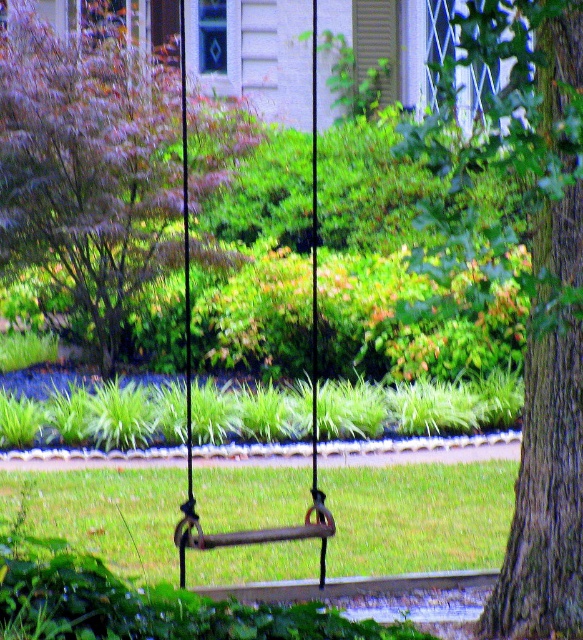
Question: Is the position of brown textured bark at right less distant than that of purple leafy tree at upper left?

Choices:
 (A) no
 (B) yes

Answer: (B)

Question: Among these points, which one is nearest to the camera?

Choices:
 (A) (528, 506)
 (B) (196, 253)

Answer: (A)

Question: Does brown textured bark at right appear on the right side of purple leafy tree at upper left?

Choices:
 (A) yes
 (B) no

Answer: (A)

Question: Does brown textured bark at right have a larger size compared to purple leafy tree at upper left?

Choices:
 (A) yes
 (B) no

Answer: (A)

Question: Among these points, which one is farthest from the camera?

Choices:
 (A) pyautogui.click(x=54, y=186)
 (B) pyautogui.click(x=581, y=56)

Answer: (A)